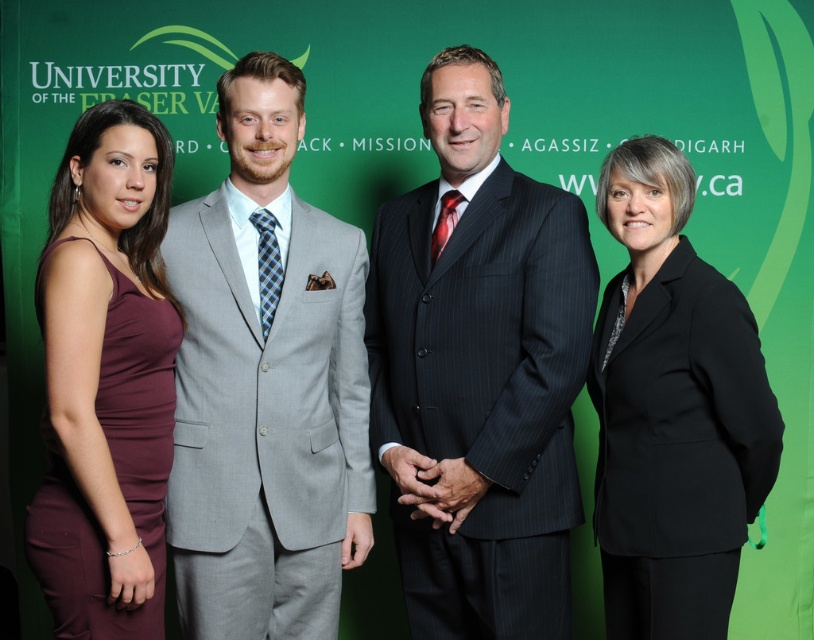
Based on the photo, is dark gray pinstripe suit at center to the right of black matte blazer at right from the viewer's perspective?

In fact, dark gray pinstripe suit at center is to the left of black matte blazer at right.

Who is shorter, dark gray pinstripe suit at center or black matte blazer at right?

Standing shorter between the two is black matte blazer at right.

Locate an element on the screen. The height and width of the screenshot is (640, 814). dark gray pinstripe suit at center is located at coordinates (479, 371).

Consider the image. Is black matte blazer at right smaller than maroon satin dress at left?

Actually, black matte blazer at right might be larger than maroon satin dress at left.

Who is positioned more to the left, black matte blazer at right or maroon satin dress at left?

maroon satin dress at left

Image resolution: width=814 pixels, height=640 pixels. Find the location of `black matte blazer at right`. black matte blazer at right is located at coordinates (672, 410).

Identify the location of black matte blazer at right. (672, 410).

Does light gray suit at center appear on the left side of black matte blazer at right?

Correct, you'll find light gray suit at center to the left of black matte blazer at right.

Where is `light gray suit at center`? The height and width of the screenshot is (640, 814). light gray suit at center is located at coordinates (265, 384).

Is point (333, 236) positioned before point (677, 394)?

No, it is not.

At what (x,y) coordinates should I click in order to perform the action: click on light gray suit at center. Please return your answer as a coordinate pair (x, y). The image size is (814, 640). Looking at the image, I should click on (265, 384).